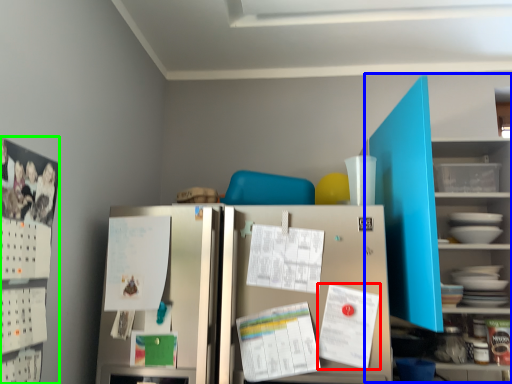
Question: Based on their relative distances, which object is nearer to paper (highlighted by a red box)? Choose from bookshelf (highlighted by a blue box) and bulletin board (highlighted by a green box).

Choices:
 (A) bookshelf
 (B) bulletin board

Answer: (A)